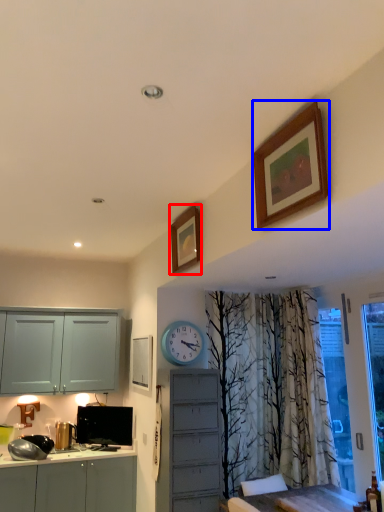
Question: Among these objects, which one is farthest to the camera, picture frame (highlighted by a red box) or picture frame (highlighted by a blue box)?

Choices:
 (A) picture frame
 (B) picture frame

Answer: (A)